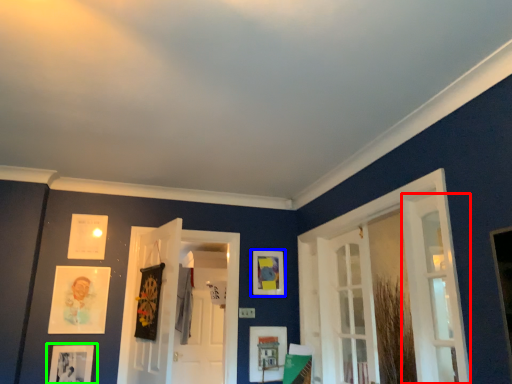
Question: Which object is positioned farthest from door (highlighted by a red box)? Select from picture frame (highlighted by a blue box) and picture frame (highlighted by a green box).

Choices:
 (A) picture frame
 (B) picture frame

Answer: (B)